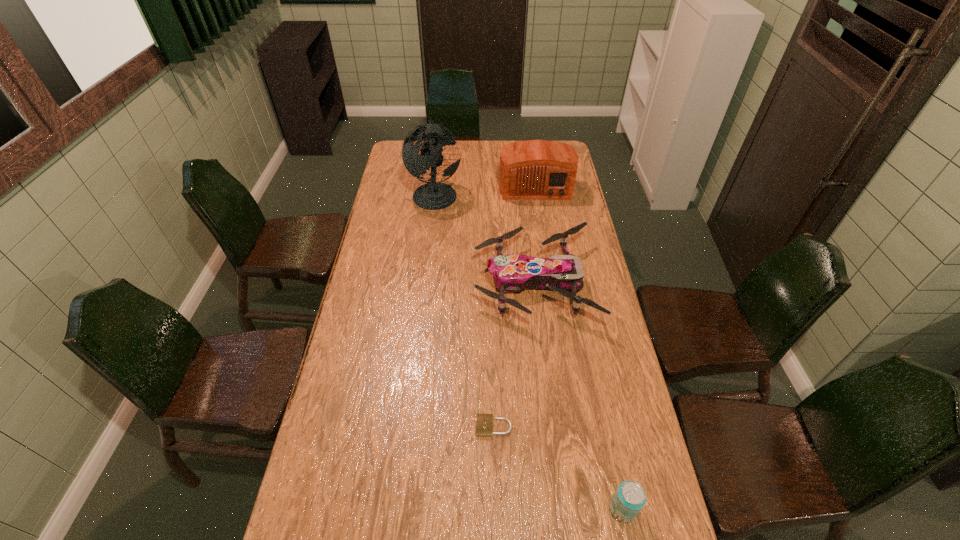
Image resolution: width=960 pixels, height=540 pixels. In the image, there is a desktop. What are the coordinates of `vacant space at the right edge` in the screenshot? It's located at (589, 252).

Image resolution: width=960 pixels, height=540 pixels. In order to click on vacant space at the far left corner in this screenshot , I will do `click(398, 140)`.

Image resolution: width=960 pixels, height=540 pixels. I want to click on blank region between the shortest object and the beer can, so click(x=558, y=468).

Where is `free spot between the fourth shortest object and the tallest object`? free spot between the fourth shortest object and the tallest object is located at coordinates (485, 190).

At what (x,y) coordinates should I click in order to perform the action: click on vacant point located between the second tallest object and the nearest object. Please return your answer as a coordinate pair (x, y). This screenshot has width=960, height=540. Looking at the image, I should click on (579, 347).

You are a GUI agent. You are given a task and a screenshot of the screen. Output one action in this format:
    pyautogui.click(x=<x>, y=<y>)
    Task: Click on the free area in between the shortest object and the beer can
    Image resolution: width=960 pixels, height=540 pixels.
    Given the screenshot: What is the action you would take?
    pyautogui.click(x=558, y=468)

Locate an element on the screen. This screenshot has width=960, height=540. empty location between the drone and the shortest object is located at coordinates (514, 355).

Identify the location of vacant region between the fourth farthest object and the nearest object. The image size is (960, 540). (558, 468).

Find the location of a particular element. The height and width of the screenshot is (540, 960). vacant area that lies between the leftmost object and the radio receiver is located at coordinates (485, 190).

Locate an element on the screen. This screenshot has width=960, height=540. unoccupied position between the nearest object and the second tallest object is located at coordinates (579, 347).